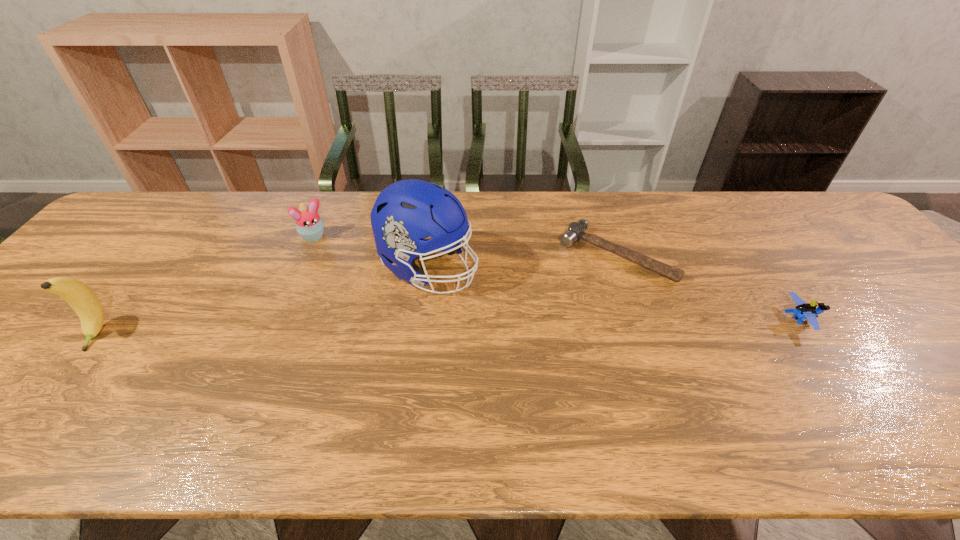
Select which object appears as the closest to the fourth shortest object. Please provide its 2D coordinates. Your answer should be formatted as a tuple, i.e. [(x, y)], where the tuple contains the x and y coordinates of a point satisfying the conditions above.

[(309, 225)]

Image resolution: width=960 pixels, height=540 pixels. What are the coordinates of `vacant point that satisfies the following two spatial constraints: 1. on the front side of the fourth tallest object; 2. on the front-facing side of the tallest object` in the screenshot? It's located at (422, 320).

The width and height of the screenshot is (960, 540). Identify the location of vacant position in the image that satisfies the following two spatial constraints: 1. on the front side of the Lego; 2. on the front-facing side of the third object from right to left. (422, 320).

This screenshot has height=540, width=960. Find the location of `vacant space that satisfies the following two spatial constraints: 1. on the front side of the cupcake; 2. on the left side of the third object from right to left`. vacant space that satisfies the following two spatial constraints: 1. on the front side of the cupcake; 2. on the left side of the third object from right to left is located at coordinates (302, 267).